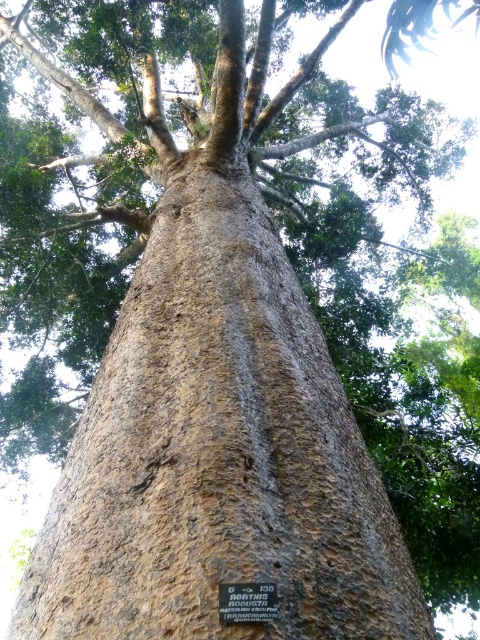
You are standing in front of the tree and want to place a plaque near the brown rough bark at center. Based on the coordinates provided, where should you position the plaque relative to the bark?

The brown rough bark at center is located at point (216, 454), so you should position the plaque near that coordinate to place it close to the bark.

You are standing 4 feet away from the base of a tree with a thick trunk. You want to place a plaque on the brown rough bark at center. Is the plaque within your reach if you can reach up to 4 feet?

The brown rough bark at center is 3.80 feet away from the viewer, so yes, the plaque can be placed since it is within your reach.